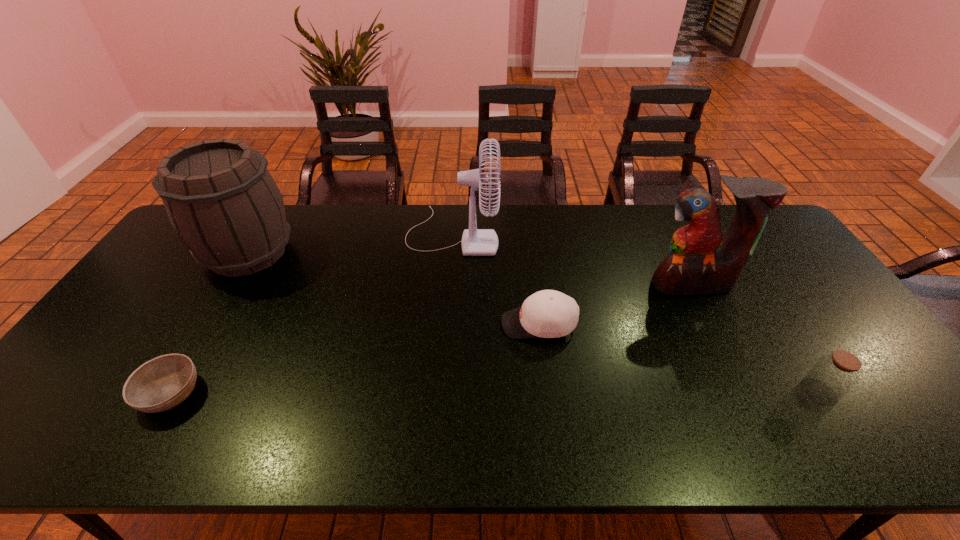
Identify the location of fan. The height and width of the screenshot is (540, 960). (475, 242).

The height and width of the screenshot is (540, 960). What are the coordinates of `parrot` in the screenshot? It's located at (702, 261).

Identify the location of wine bucket. This screenshot has width=960, height=540. (220, 198).

Where is `the third shortest object`? the third shortest object is located at coordinates (833, 376).

Where is `jar`? jar is located at coordinates (833, 376).

Locate an element on the screen. This screenshot has height=540, width=960. the fourth farthest object is located at coordinates (548, 313).

You are a GUI agent. You are given a task and a screenshot of the screen. Output one action in this format:
    pyautogui.click(x=<x>, y=<y>)
    Task: Click on the second shortest object
    
    Given the screenshot: What is the action you would take?
    pyautogui.click(x=548, y=313)

You are a GUI agent. You are given a task and a screenshot of the screen. Output one action in this format:
    pyautogui.click(x=<x>, y=<y>)
    Task: Click on the shortest object
    
    Given the screenshot: What is the action you would take?
    pyautogui.click(x=162, y=383)

Find the location of `free space located 0.290m on the front-facing side of the fan`. free space located 0.290m on the front-facing side of the fan is located at coordinates (583, 234).

Where is `vacant area situated 0.310m at the face of the parrot`? This screenshot has height=540, width=960. vacant area situated 0.310m at the face of the parrot is located at coordinates (746, 391).